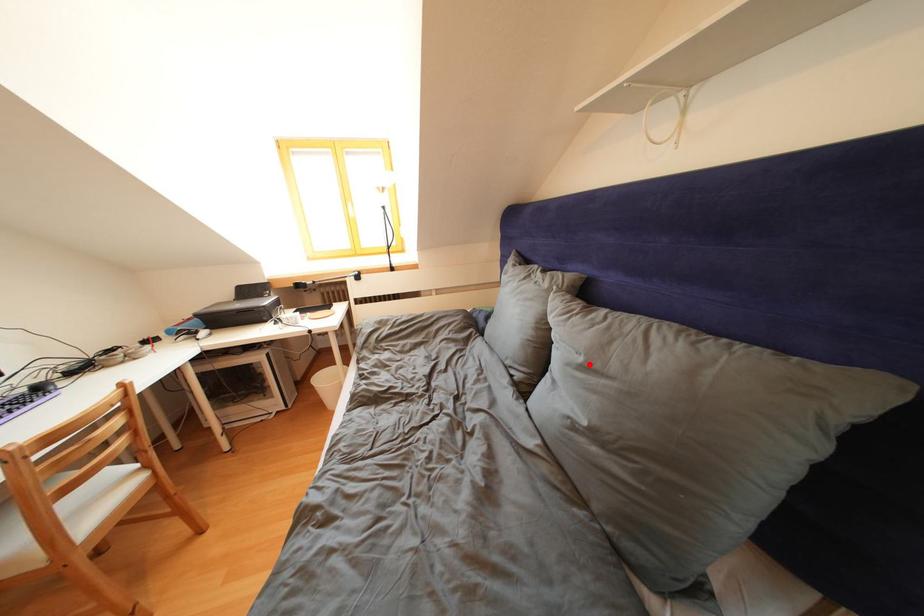
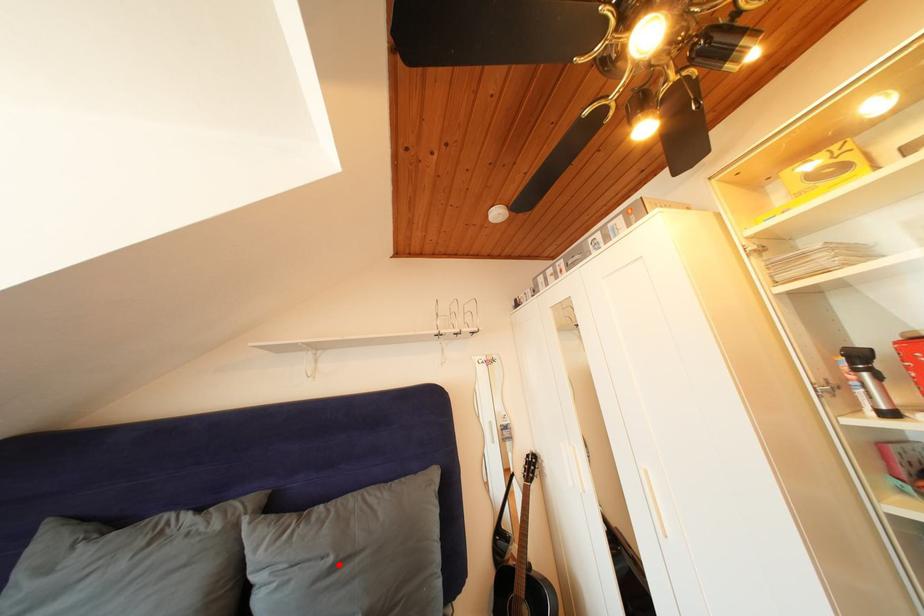
I am providing you with two images of the same scene from different viewpoints. A red point is marked on the first image and another point is marked on the second image. Is the red point in image1 aligned with the point shown in image2?

Yes